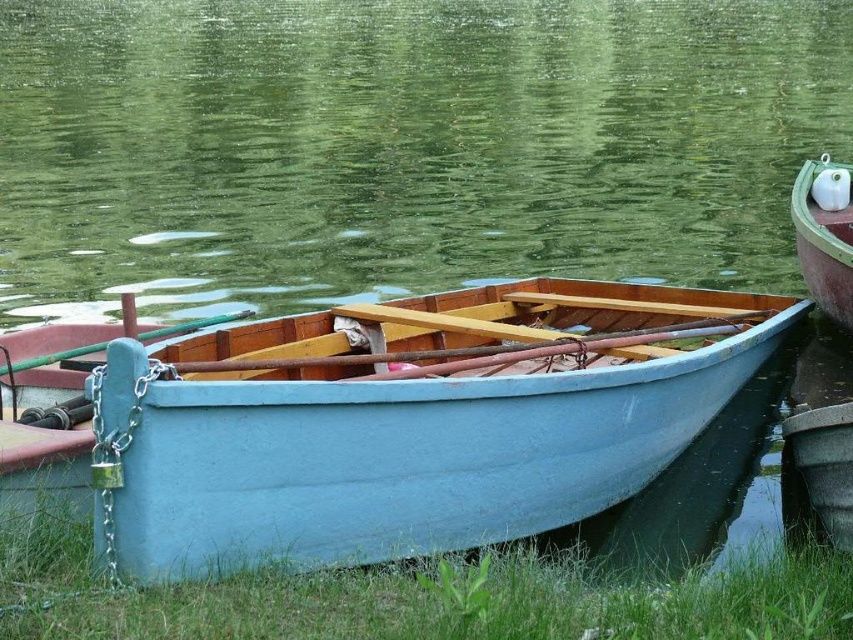
Question: Can you confirm if light blue wood boat at center is positioned above green wooden boat at right?

Choices:
 (A) no
 (B) yes

Answer: (A)

Question: Among these points, which one is nearest to the camera?

Choices:
 (A) (321, 598)
 (B) (660, 179)
 (C) (416, 534)

Answer: (A)

Question: Which of the following is the farthest from the observer?

Choices:
 (A) green wooden boat at right
 (B) light blue wood boat at center
 (C) green grass at lower center
 (D) green water at center

Answer: (D)

Question: Does green grass at lower center come behind green wooden boat at right?

Choices:
 (A) no
 (B) yes

Answer: (A)

Question: Does green water at center appear on the right side of green grass at lower center?

Choices:
 (A) yes
 (B) no

Answer: (B)

Question: Which of these objects is positioned closest to the green grass at lower center?

Choices:
 (A) green water at center
 (B) light blue wood boat at center
 (C) green wooden boat at right

Answer: (B)